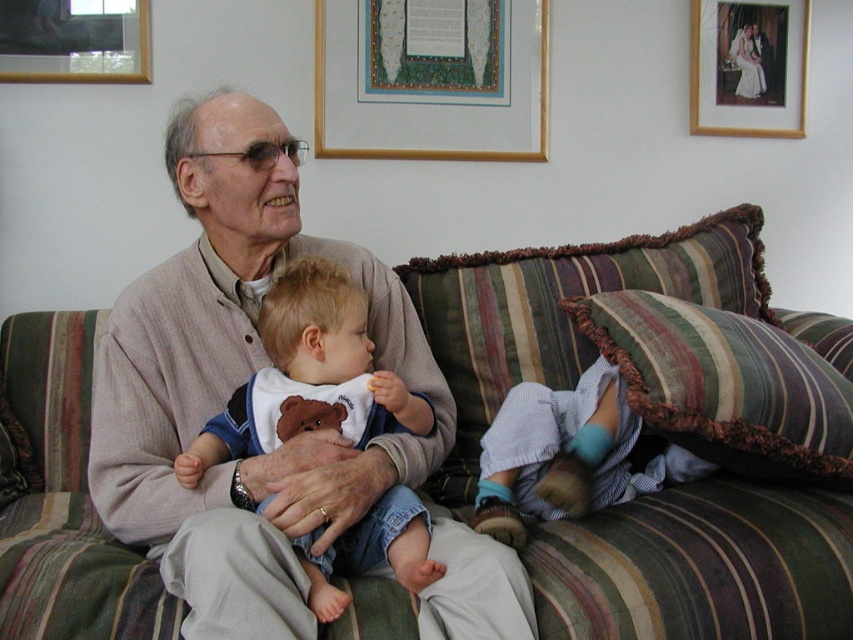
Question: Does light beige cardigan at center appear over gold-framed picture at upper center?

Choices:
 (A) no
 (B) yes

Answer: (A)

Question: Among these objects, which one is nearest to the camera?

Choices:
 (A) striped fabric couch at center
 (B) white cotton bib at center
 (C) striped fabric pillow at right
 (D) gold-framed picture at upper center

Answer: (B)

Question: Does striped cotton pants at lower right come behind wooden picture frame at upper right?

Choices:
 (A) yes
 (B) no

Answer: (B)

Question: Is white cotton bib at center wider than brushed metal picture frame at upper left?

Choices:
 (A) no
 (B) yes

Answer: (B)

Question: Which object appears farthest from the camera in this image?

Choices:
 (A) white cotton bib at center
 (B) wooden picture frame at upper right
 (C) striped fabric pillow at right
 (D) striped fabric couch at center

Answer: (B)

Question: Which object is the farthest from the striped fabric couch at center?

Choices:
 (A) white cotton bib at center
 (B) wooden picture frame at upper right
 (C) striped cotton pants at lower right
 (D) gold-framed picture at upper center

Answer: (B)